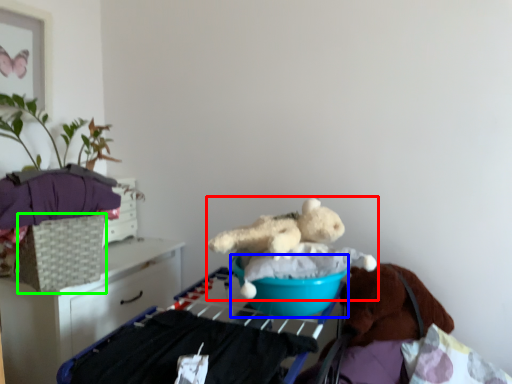
Question: Estimate the real-world distances between objects in this image. Which object is closer to teddy bear (highlighted by a red box), basin (highlighted by a blue box) or basket (highlighted by a green box)?

Choices:
 (A) basin
 (B) basket

Answer: (A)